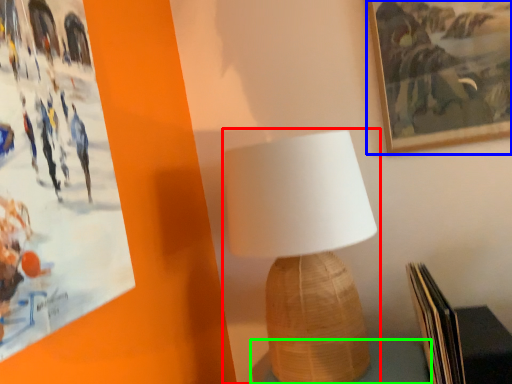
Question: Which object is the closest to the lamp (highlighted by a red box)? Choose among these: picture frame (highlighted by a blue box) or table (highlighted by a green box).

Choices:
 (A) picture frame
 (B) table

Answer: (B)